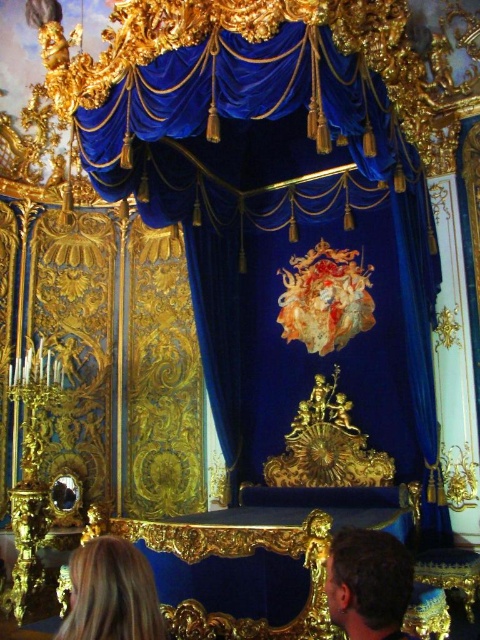
Does blonde hair at lower left have a greater width compared to brown hair at lower right?

Yes.

Who is more forward, (96, 605) or (357, 544)?

Point (96, 605) is more forward.

Image resolution: width=480 pixels, height=640 pixels. What are the coordinates of `blonde hair at lower left` in the screenshot? It's located at (111, 593).